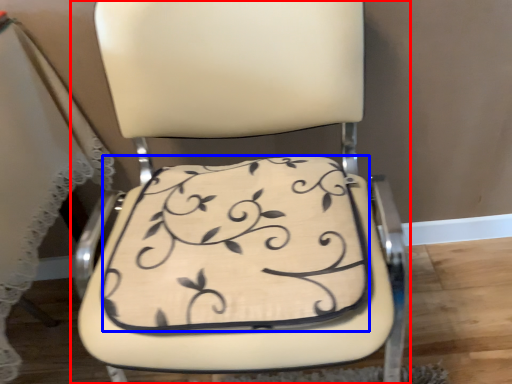
Question: Among these objects, which one is farthest to the camera, chair (highlighted by a red box) or pillow (highlighted by a blue box)?

Choices:
 (A) chair
 (B) pillow

Answer: (B)